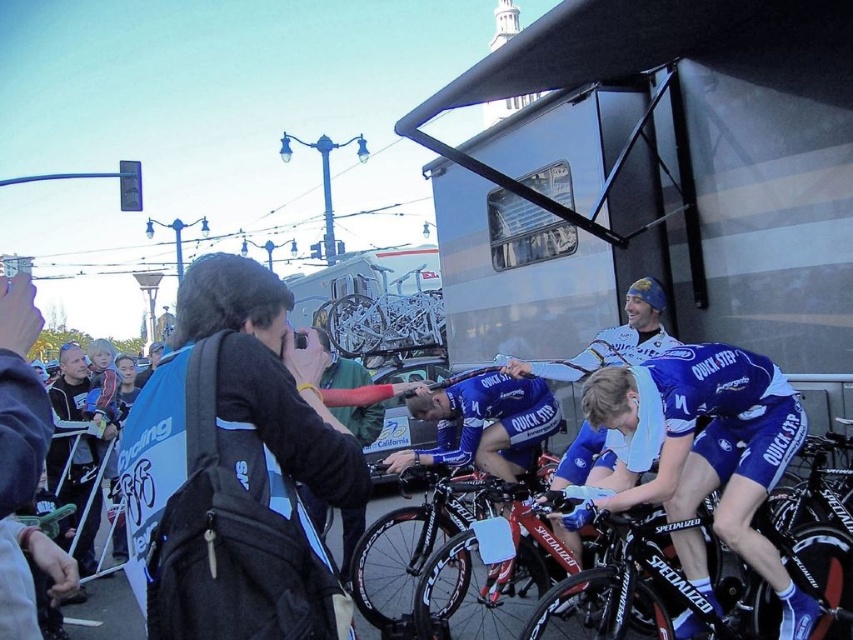
You are a photographer at the cycling event. You need to take a photo of both the silver metallic trailer at upper right and the silver metallic bicycle at center. However, your camera can only focus on objects within a specific height range. The trailer is much taller than the bicycle. Will you need to adjust the camera focus to capture both objects clearly?

The silver metallic trailer at upper right is much taller than the silver metallic bicycle at center. Since the trailer is taller, you may need to adjust the camera focus to ensure both objects are within the camera focus range. However, without knowing the exact height range of the camera, it is difficult to determine if adjustment is necessary.

You are a photographer standing near the banner and want to take a photo of both the black matte bicycle at center and the silver metallic bicycle at center. Given that your camera has a maximum focus range of 100 feet, will you be able to capture both bicycles in a single shot without moving?

The black matte bicycle at center and silver metallic bicycle at center are 120.04 feet apart from each other. Since the distance exceeds the camera maximum focus range of 100 feet, you cannot capture both bicycles in a single shot without moving.

You are a photographer at the cycling event. You need to capture a photo that includes both the silver metallic trailer at upper right and the silver metallic bicycle at center. Given their sizes, which object should you position closer to the camera to ensure both are visible in the frame without cropping?

Since the silver metallic trailer at upper right is larger than the silver metallic bicycle at center, you should position the silver metallic bicycle at center closer to the camera. This way, the smaller bicycle will appear larger in the frame, balancing the sizes and allowing both to fit without cropping.